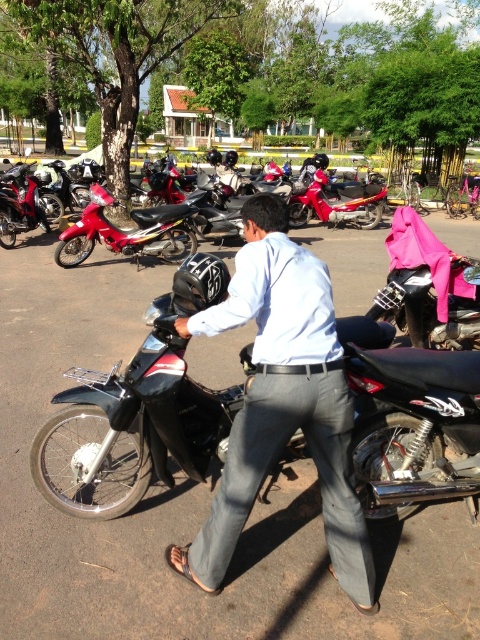
You are a motorcycle enthusiast standing in the parking area. You see the shiny red motorcycle at center and the matte red motorcycle at left. Which one is closer to you?

The shiny red motorcycle at center is closer to you because it is in front of the matte red motorcycle at left.

Looking at this image, you are standing in the parking area and want to take a photo of the two points mentioned. Which point, point (x=156, y=358) or point (x=361, y=188), will appear larger in your camera view?

Point (x=156, y=358) is closer to the camera than point (x=361, y=188), so it will appear larger in the camera view.

You are a parking attendant who needs to move the shiny red motorcycle at center and the matte red motorcycle at left to another parking spot. Based on their sizes, which motorcycle will require more space to park?

The matte red motorcycle at left requires more space to park because it occupies more space than the shiny red motorcycle at center.